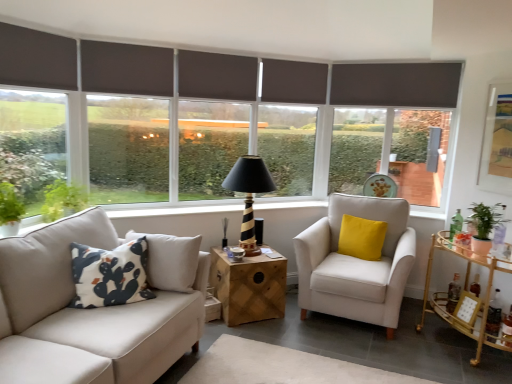
Question: Is matte gold-framed artwork at upper right turned away from matte gray roller blind at center, the fourth window in the left-to-right sequence?

Choices:
 (A) no
 (B) yes

Answer: (A)

Question: From the image's perspective, is matte gold-framed artwork at upper right above matte gray roller blind at center, acting as the first window starting from the right?

Choices:
 (A) yes
 (B) no

Answer: (B)

Question: Is there a large distance between matte gold-framed artwork at upper right and matte gray roller blind at center, the fourth window in the left-to-right sequence?

Choices:
 (A) no
 (B) yes

Answer: (B)

Question: From a real-world perspective, is matte gold-framed artwork at upper right on top of matte gray roller blind at center, acting as the first window starting from the right?

Choices:
 (A) no
 (B) yes

Answer: (B)

Question: Is matte gold-framed artwork at upper right behind matte gray roller blind at center, the fourth window in the left-to-right sequence?

Choices:
 (A) yes
 (B) no

Answer: (B)

Question: Is matte gold-framed artwork at upper right bigger than matte gray roller blind at center, the fourth window in the left-to-right sequence?

Choices:
 (A) no
 (B) yes

Answer: (A)

Question: Does dark gray roller blind at left, which is the 4th window from right to left, have a lesser width compared to brown fabric shutter at upper center, placed as the third shutter when sorted from front to back?

Choices:
 (A) yes
 (B) no

Answer: (B)

Question: Is brown fabric shutter at upper center, which is the third shutter from left to right, at the back of dark gray roller blind at left, the first window positioned from the left?

Choices:
 (A) no
 (B) yes

Answer: (A)

Question: Is dark gray roller blind at left, the first window positioned from the left, oriented towards brown fabric shutter at upper center, acting as the second shutter starting from the right?

Choices:
 (A) yes
 (B) no

Answer: (B)

Question: Can you confirm if dark gray roller blind at left, the first window positioned from the left, is smaller than brown fabric shutter at upper center, placed as the third shutter when sorted from front to back?

Choices:
 (A) yes
 (B) no

Answer: (B)

Question: Is dark gray roller blind at left, the first window positioned from the left, to the left of brown fabric shutter at upper center, which is the third shutter from left to right, from the viewer's perspective?

Choices:
 (A) no
 (B) yes

Answer: (B)

Question: Does dark gray roller blind at left, which is the 4th window from right to left, have a greater height compared to brown fabric shutter at upper center, which is the third shutter from left to right?

Choices:
 (A) no
 (B) yes

Answer: (B)

Question: Are dark gray roller blind at left, the first window positioned from the left, and dark gray roller blind at center, positioned as the 3th window in left-to-right order, making contact?

Choices:
 (A) no
 (B) yes

Answer: (A)